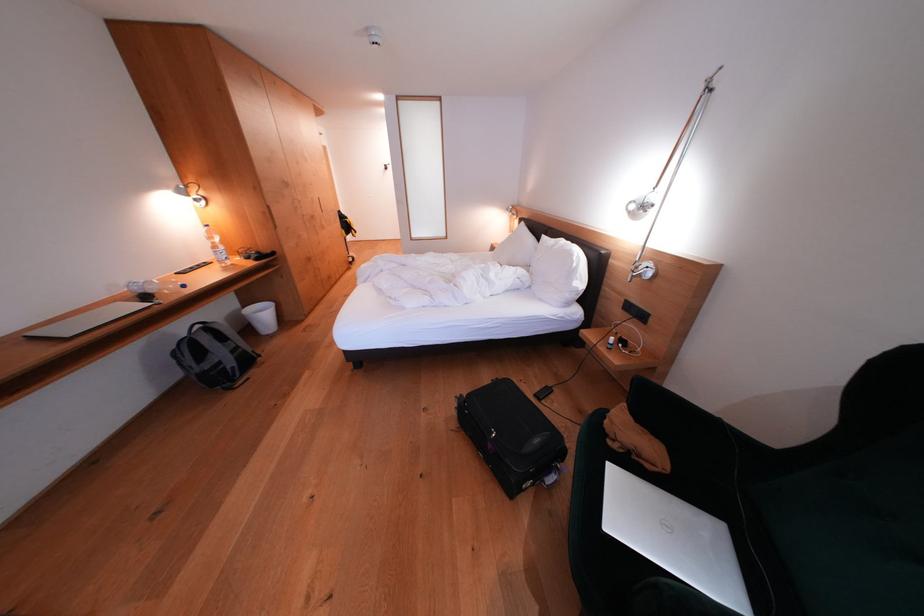
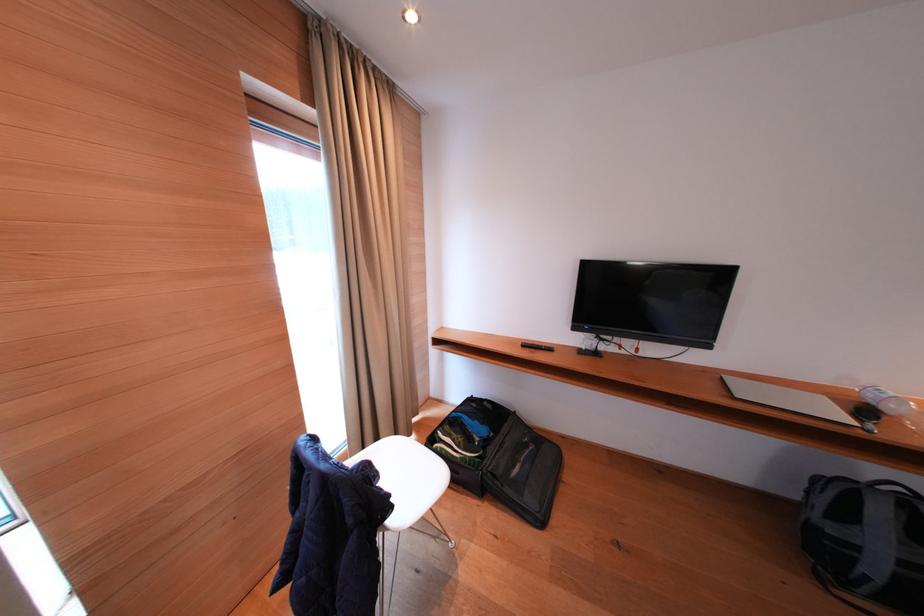
In the second image, find the point that corresponds to (x=42, y=338) in the first image.

(735, 383)